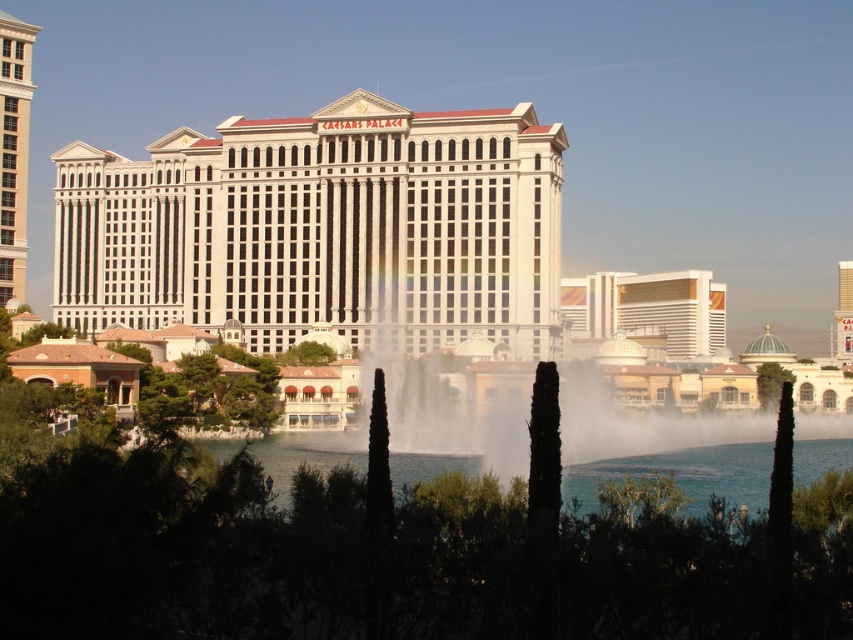
Question: Does white glossy building at center have a smaller size compared to clear water at center?

Choices:
 (A) yes
 (B) no

Answer: (B)

Question: Which point appears farthest from the camera in this image?

Choices:
 (A) (15, 192)
 (B) (672, 310)
 (C) (219, 449)

Answer: (B)

Question: Can you confirm if clear water at center is positioned below gold/brick hotel at right?

Choices:
 (A) yes
 (B) no

Answer: (A)

Question: Which object is farther from the camera taking this photo?

Choices:
 (A) gold/brick hotel at right
 (B) white glossy building at center
 (C) clear water at center
 (D) white glossy building at left

Answer: (A)

Question: Which point is farther to the camera?

Choices:
 (A) white glossy building at center
 (B) gold/brick hotel at right
 (C) clear water at center

Answer: (B)

Question: Can you confirm if white glossy building at center is positioned to the left of white glossy building at left?

Choices:
 (A) no
 (B) yes

Answer: (A)